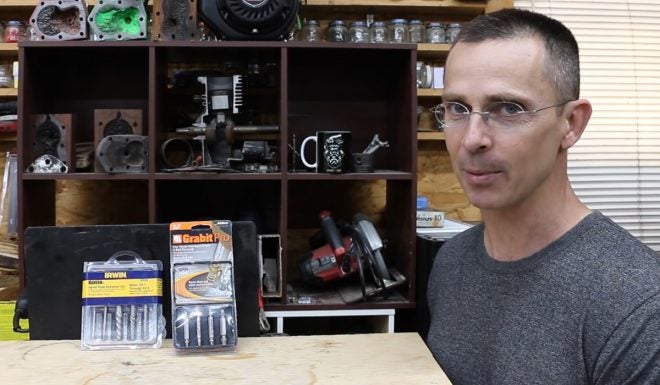
This screenshot has height=385, width=660. I want to click on white shelf, so click(x=292, y=311).